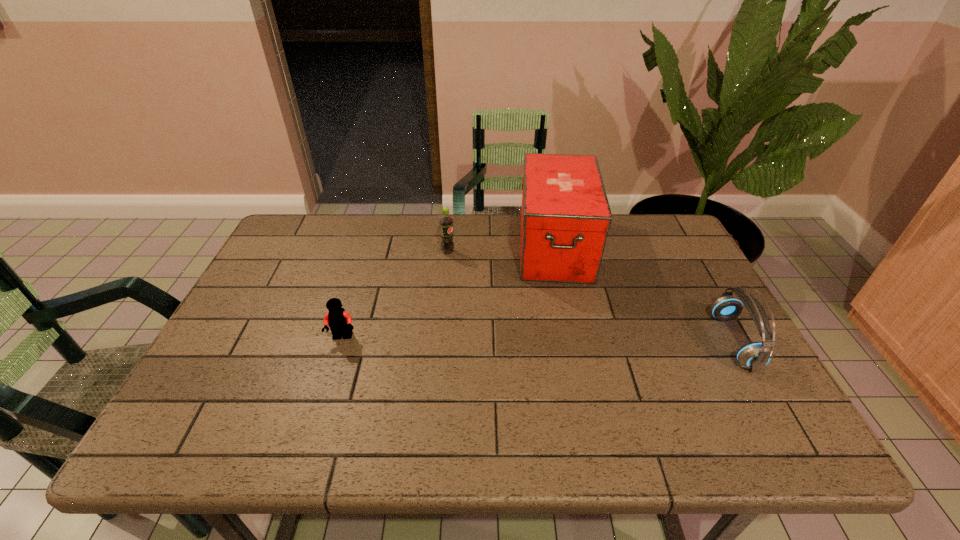
Find the location of a particular element. vacant space in between the Lego and the first-aid kit is located at coordinates (449, 292).

This screenshot has width=960, height=540. Identify the location of vacant space that's between the first-aid kit and the shortest object. (449, 292).

Locate an element on the screen. The image size is (960, 540). free space between the headset and the Lego is located at coordinates (539, 339).

At what (x,y) coordinates should I click in order to perform the action: click on vacant space in between the second object from right to left and the third object from right to left. Please return your answer as a coordinate pair (x, y). This screenshot has width=960, height=540. Looking at the image, I should click on (501, 249).

You are a GUI agent. You are given a task and a screenshot of the screen. Output one action in this format:
    pyautogui.click(x=<x>, y=<y>)
    Task: Click on the free space between the second object from left to right and the leftmost object
    Image resolution: width=960 pixels, height=540 pixels.
    Given the screenshot: What is the action you would take?
    pyautogui.click(x=396, y=295)

In order to click on vacant area that lies between the headset and the first-aid kit in this screenshot , I will do `click(645, 294)`.

Image resolution: width=960 pixels, height=540 pixels. In order to click on free space between the shortest object and the second object from left to right in this screenshot , I will do `click(396, 295)`.

The height and width of the screenshot is (540, 960). What are the coordinates of `free spot between the rightmost object and the first-aid kit` in the screenshot? It's located at (645, 294).

Identify which object is located as the nearest to the first-aid kit. Please provide its 2D coordinates. Your answer should be formatted as a tuple, i.e. [(x, y)], where the tuple contains the x and y coordinates of a point satisfying the conditions above.

[(447, 245)]

Where is `object that ranks as the closest to the rightmost object`? object that ranks as the closest to the rightmost object is located at coordinates (565, 216).